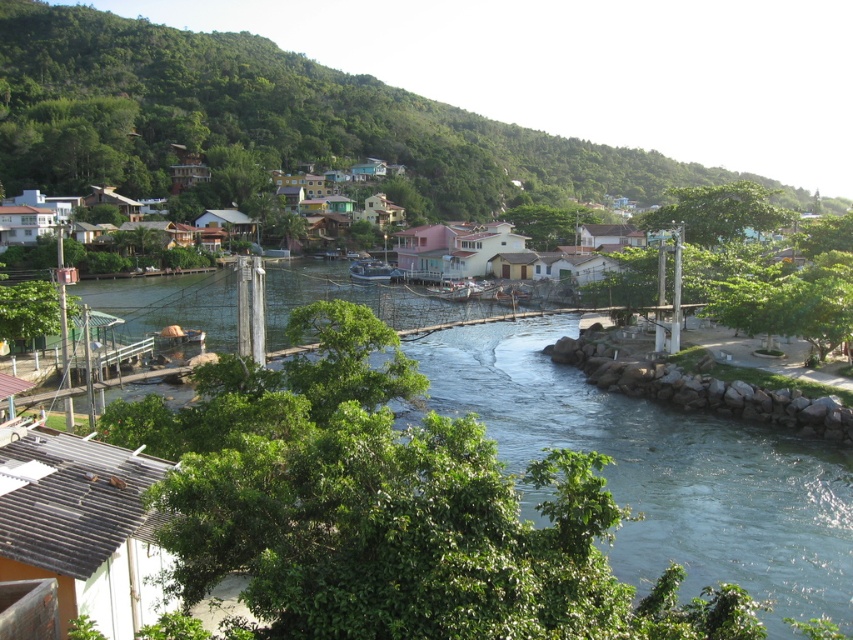
Does green leafy hillside at upper center appear on the left side of metallic silver boat at center?

Incorrect, green leafy hillside at upper center is not on the left side of metallic silver boat at center.

In the scene shown: Which is below, green leafy hillside at upper center or metallic silver boat at center?

metallic silver boat at center is below.

Locate an element on the screen. The image size is (853, 640). green leafy hillside at upper center is located at coordinates (270, 122).

Is green leafy hillside at upper center wider than clear blue water at center?

Indeed, green leafy hillside at upper center has a greater width compared to clear blue water at center.

Which is below, green leafy hillside at upper center or clear blue water at center?

clear blue water at center is below.

Identify the location of green leafy hillside at upper center. This screenshot has height=640, width=853. (270, 122).

What do you see at coordinates (665, 470) in the screenshot? The image size is (853, 640). I see `clear blue water at center` at bounding box center [665, 470].

Identify the location of clear blue water at center. The height and width of the screenshot is (640, 853). [x=665, y=470].